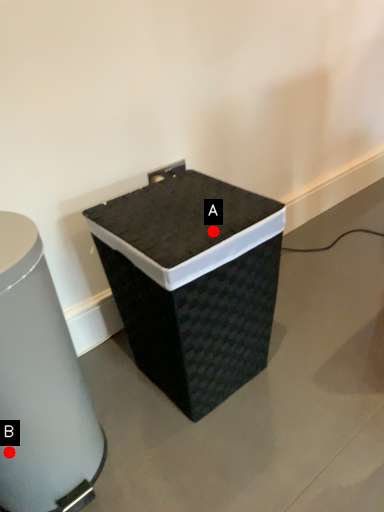
Question: Two points are circled on the image, labeled by A and B beside each circle. Which of the following is the farthest from the observer?

Choices:
 (A) A is further
 (B) B is further

Answer: (A)